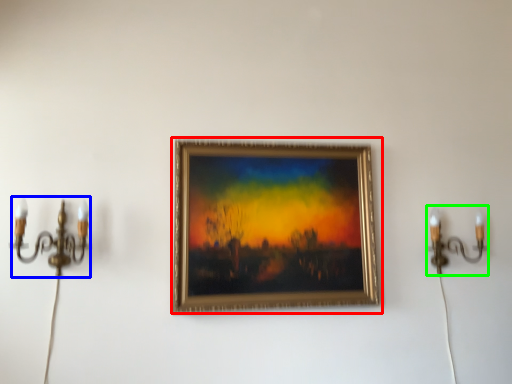
Question: Which is nearer to the picture frame (highlighted by a red box)? candle holder (highlighted by a blue box) or candle holder (highlighted by a green box).

Choices:
 (A) candle holder
 (B) candle holder

Answer: (B)